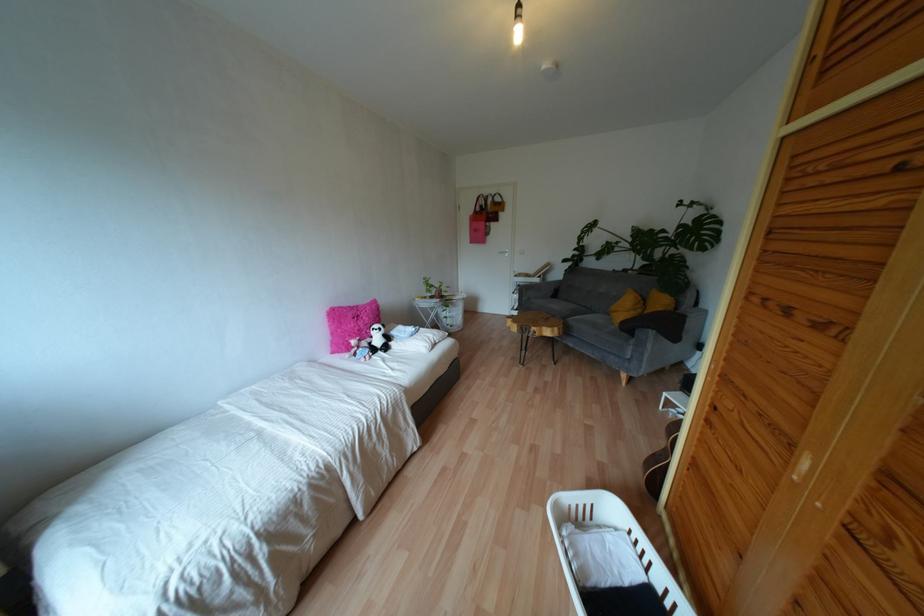
I want to click on panda stuffed animal, so click(x=371, y=342).